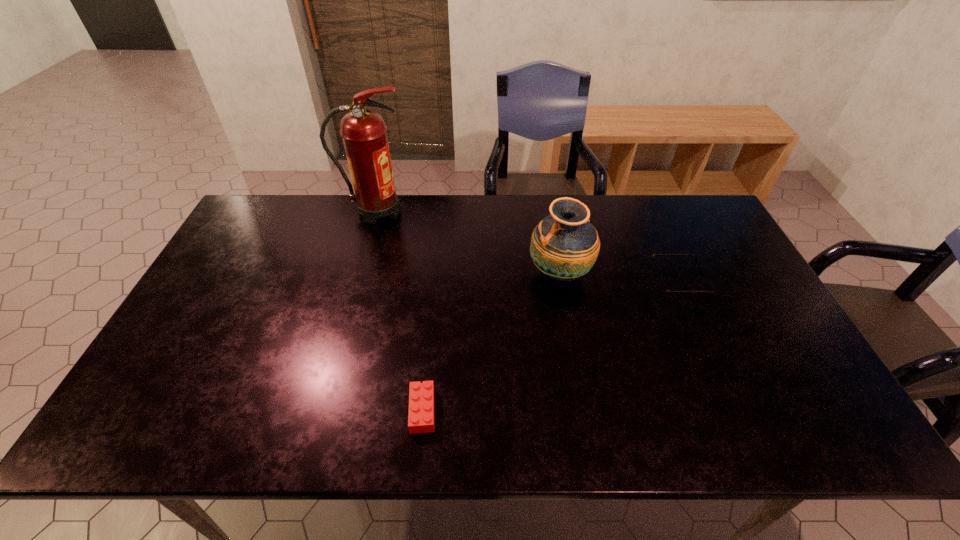
In the image, there is a desktop. Find the location of `vacant space at the right edge`. vacant space at the right edge is located at coordinates (769, 333).

You are a GUI agent. You are given a task and a screenshot of the screen. Output one action in this format:
    pyautogui.click(x=<x>, y=<y>)
    Task: Click on the free space at the far left corner of the desktop
    
    Given the screenshot: What is the action you would take?
    pyautogui.click(x=297, y=199)

What are the coordinates of `free space between the Lego and the spectacles` in the screenshot? It's located at 551,347.

Where is `vacant area between the spectacles and the farthest object`? The width and height of the screenshot is (960, 540). vacant area between the spectacles and the farthest object is located at coordinates (528, 247).

Where is `blank region between the second object from right to left and the leftmost object`? This screenshot has height=540, width=960. blank region between the second object from right to left and the leftmost object is located at coordinates (468, 242).

The image size is (960, 540). What are the coordinates of `vacant region between the Lego and the pottery` in the screenshot? It's located at (491, 342).

This screenshot has width=960, height=540. In order to click on blank region between the second object from left to right and the spectacles in this screenshot , I will do `click(551, 347)`.

This screenshot has height=540, width=960. I want to click on free point between the nearest object and the third tallest object, so click(x=551, y=347).

This screenshot has width=960, height=540. Find the location of `blank region between the leftmost object and the rightmost object`. blank region between the leftmost object and the rightmost object is located at coordinates (528, 247).

Find the location of `vacant area that lies between the pottery and the shortest object`. vacant area that lies between the pottery and the shortest object is located at coordinates (491, 342).